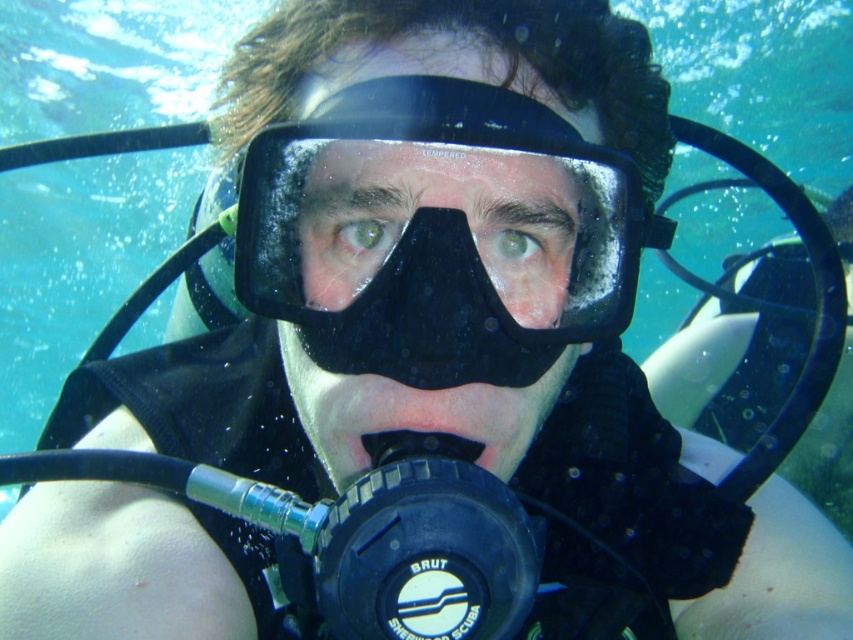
What are the coordinates of the black matte scuba mask at center?

The black matte scuba mask at center is located at coordinates point (434, 230).

You are an underwater photographer trying to capture a clear shot of the regulator. The regulator has two parts visible here, the matte black nose at center and the black rubber mouthpiece at center. Which part is closer to the camera lens?

The matte black nose at center is positioned over the black rubber mouthpiece at center, so the matte black nose at center is closer to the camera lens.